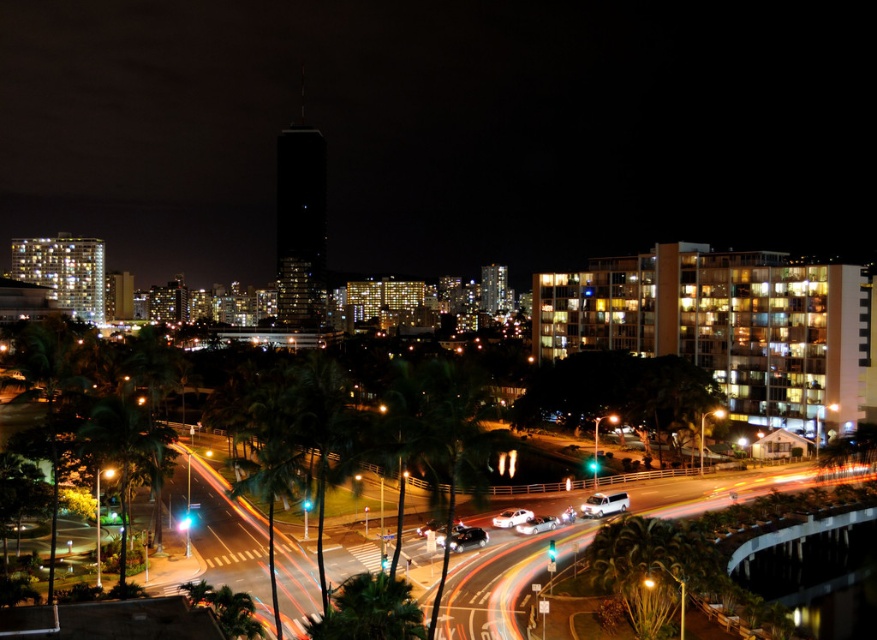
You are a photographer planning to capture a cityscape with a wide angle lens. You want to ensure that both the green leafy palm tree at lower left and the white glossy car at center are in frame. Based on their sizes in the image, which object will occupy more space in the final photo?

The green leafy palm tree at lower left will occupy more space in the final photo because its width is larger than the white glossy car at center.

Based on the photo, you are a photographer standing at the edge of the road. You want to capture a photo that includes both the green leafy palm tree at lower left and the white glossy car at center. Which object should you focus on first to ensure both are in frame?

The green leafy palm tree at lower left is larger in size than the white glossy car at center, so you should focus on the palm tree first to ensure it fits within the frame while still capturing the car.

You are a parking attendant who needs to park a 1.5 meter wide delivery van between the white glossy car at center and the shiny silver sedan at center. Can the delivery van fit between them?

The white glossy car at center is 1.69 meters from the shiny silver sedan at center. Since the delivery van is 1.5 meters wide, it can fit between them as the distance is sufficient.